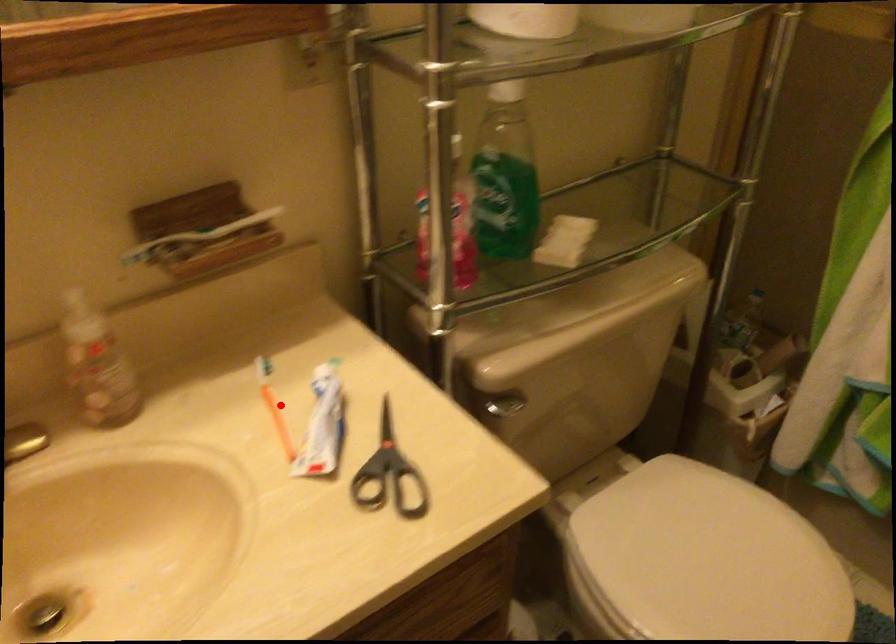
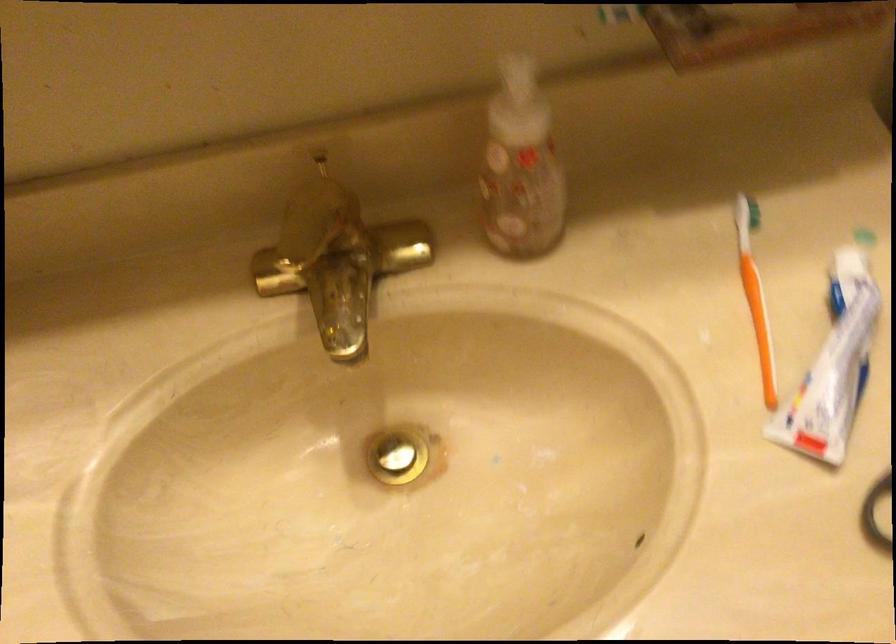
Question: I am providing you with two images of the same scene from different viewpoints. In image1, a red point is highlighted. Considering the same 3D point in image2, which of the following is correct?

Choices:
 (A) It is closer
 (B) It is farther

Answer: (A)